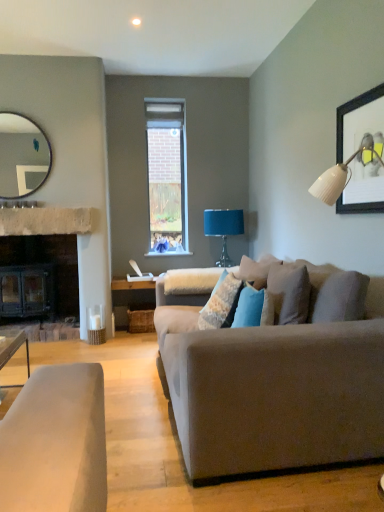
Question: Is wooden framed artwork at upper right smaller than matte silver mirror at upper left?

Choices:
 (A) yes
 (B) no

Answer: (A)

Question: Can you confirm if wooden framed artwork at upper right is taller than matte silver mirror at upper left?

Choices:
 (A) yes
 (B) no

Answer: (B)

Question: Can you confirm if wooden framed artwork at upper right is bigger than matte silver mirror at upper left?

Choices:
 (A) yes
 (B) no

Answer: (B)

Question: Is wooden framed artwork at upper right further to the viewer compared to matte silver mirror at upper left?

Choices:
 (A) no
 (B) yes

Answer: (A)

Question: Can you confirm if wooden framed artwork at upper right is wider than matte silver mirror at upper left?

Choices:
 (A) yes
 (B) no

Answer: (B)

Question: Is natural stone mantle at left wider or thinner than matte silver mirror at upper left?

Choices:
 (A) wide
 (B) thin

Answer: (A)

Question: In terms of size, does natural stone mantle at left appear bigger or smaller than matte silver mirror at upper left?

Choices:
 (A) big
 (B) small

Answer: (B)

Question: From the image's perspective, relative to matte silver mirror at upper left, is natural stone mantle at left above or below?

Choices:
 (A) above
 (B) below

Answer: (B)

Question: From a real-world perspective, relative to matte silver mirror at upper left, is natural stone mantle at left vertically above or below?

Choices:
 (A) below
 (B) above

Answer: (A)

Question: From a real-world perspective, is natural stone mantle at left above or below textured blue pillow at center?

Choices:
 (A) below
 (B) above

Answer: (B)

Question: Is natural stone mantle at left bigger or smaller than textured blue pillow at center?

Choices:
 (A) small
 (B) big

Answer: (A)

Question: Is natural stone mantle at left in front of or behind textured blue pillow at center in the image?

Choices:
 (A) behind
 (B) front

Answer: (A)

Question: From the image's perspective, is natural stone mantle at left positioned above or below textured blue pillow at center?

Choices:
 (A) below
 (B) above

Answer: (B)

Question: From the image's perspective, is matte silver mirror at upper left above or below wooden framed artwork at upper right?

Choices:
 (A) below
 (B) above

Answer: (B)

Question: Do you think matte silver mirror at upper left is within wooden framed artwork at upper right, or outside of it?

Choices:
 (A) outside
 (B) inside

Answer: (A)